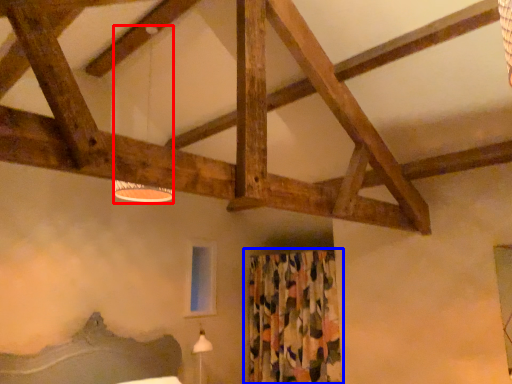
Question: Which of the following is the closest to the observer, lamp (highlighted by a red box) or curtain (highlighted by a blue box)?

Choices:
 (A) lamp
 (B) curtain

Answer: (A)